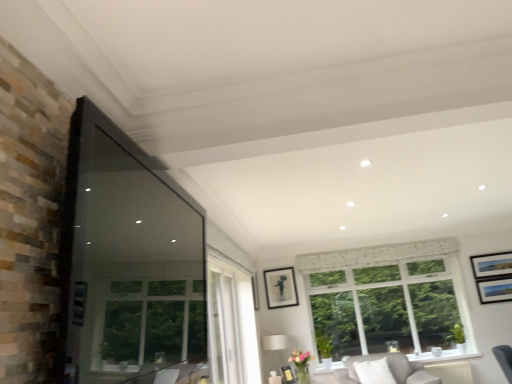
Question: Is matte black picture frame at lower center, which is counted as the 3th picture frame, starting from the top, positioned far away from transparent glass window screen at left?

Choices:
 (A) yes
 (B) no

Answer: (A)

Question: Is matte black picture frame at lower center, which is counted as the 3th picture frame, starting from the top, beside transparent glass window screen at left?

Choices:
 (A) no
 (B) yes

Answer: (A)

Question: Is the position of matte black picture frame at lower center, which is the first picture frame in bottom-to-top order, more distant than that of transparent glass window screen at left?

Choices:
 (A) no
 (B) yes

Answer: (B)

Question: Could you tell me if matte black picture frame at lower center, which is the first picture frame in bottom-to-top order, is turned towards transparent glass window screen at left?

Choices:
 (A) no
 (B) yes

Answer: (A)

Question: From the image's perspective, is matte black picture frame at lower center, which is the first picture frame in bottom-to-top order, located beneath transparent glass window screen at left?

Choices:
 (A) no
 (B) yes

Answer: (B)

Question: Is white lace curtain at upper center situated inside light gray fabric couch at lower right or outside?

Choices:
 (A) inside
 (B) outside

Answer: (B)

Question: From their relative heights in the image, would you say white lace curtain at upper center is taller or shorter than light gray fabric couch at lower right?

Choices:
 (A) short
 (B) tall

Answer: (A)

Question: Visually, is white lace curtain at upper center positioned to the left or to the right of light gray fabric couch at lower right?

Choices:
 (A) left
 (B) right

Answer: (A)

Question: Considering the positions of point (374, 249) and point (419, 377), is point (374, 249) closer or farther from the camera than point (419, 377)?

Choices:
 (A) farther
 (B) closer

Answer: (A)

Question: Considering the positions of light gray fabric couch at lower right and matte black picture frame at lower center, which is the first picture frame in bottom-to-top order, in the image, is light gray fabric couch at lower right wider or thinner than matte black picture frame at lower center, which is the first picture frame in bottom-to-top order,?

Choices:
 (A) wide
 (B) thin

Answer: (B)

Question: From a real-world perspective, is light gray fabric couch at lower right above or below matte black picture frame at lower center, which is the first picture frame in bottom-to-top order?

Choices:
 (A) above
 (B) below

Answer: (B)

Question: Is light gray fabric couch at lower right inside or outside of matte black picture frame at lower center, which is the first picture frame in bottom-to-top order?

Choices:
 (A) outside
 (B) inside

Answer: (A)

Question: Relative to matte black picture frame at lower center, which is counted as the 3th picture frame, starting from the top, is light gray fabric couch at lower right in front or behind?

Choices:
 (A) behind
 (B) front

Answer: (B)

Question: Is black glossy picture frame at center, the second picture frame from the top, to the left or to the right of matte black picture frame at lower center, which is counted as the 3th picture frame, starting from the top, in the image?

Choices:
 (A) left
 (B) right

Answer: (A)

Question: Is black glossy picture frame at center, placed as the second picture frame when sorted from bottom to top, spatially inside matte black picture frame at lower center, which is counted as the 3th picture frame, starting from the top, or outside of it?

Choices:
 (A) outside
 (B) inside

Answer: (A)